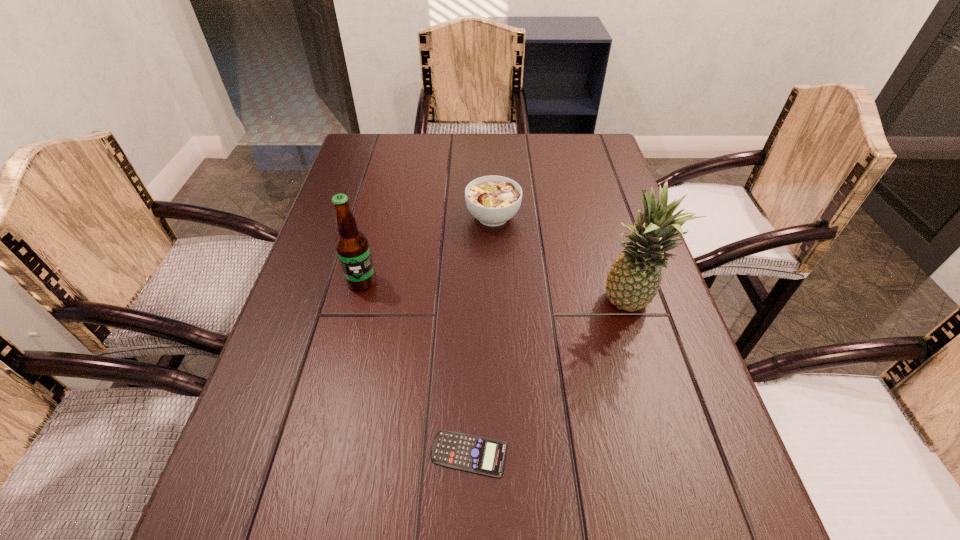
Locate an element on the screen. pineapple is located at coordinates click(634, 279).

Identify the location of the tallest object. The width and height of the screenshot is (960, 540). pos(634,279).

Where is `the leftmost object`? The width and height of the screenshot is (960, 540). the leftmost object is located at coordinates (352, 246).

At what (x,y) coordinates should I click in order to perform the action: click on beer bottle. Please return your answer as a coordinate pair (x, y). Looking at the image, I should click on (352, 246).

Locate an element on the screen. The width and height of the screenshot is (960, 540). soup bowl is located at coordinates (493, 200).

Identify the location of the farthest object. The width and height of the screenshot is (960, 540). (493, 200).

This screenshot has height=540, width=960. I want to click on the shortest object, so click(481, 455).

Find the location of a particular element. The width and height of the screenshot is (960, 540). calculator is located at coordinates (481, 455).

The height and width of the screenshot is (540, 960). I want to click on vacant region located on the front of the rightmost object, so click(655, 389).

What are the coordinates of `free spot located on the label of the second tallest object` in the screenshot? It's located at (327, 416).